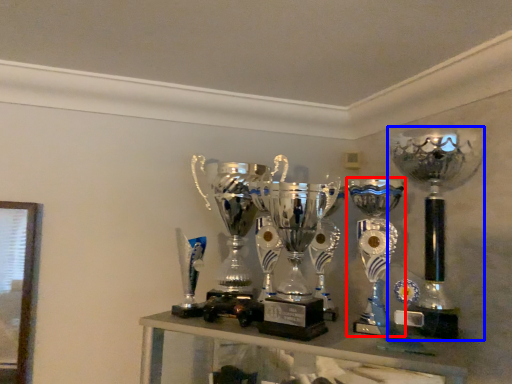
Question: Which point is closer to the camera, trophy (highlighted by a red box) or trophy (highlighted by a blue box)?

Choices:
 (A) trophy
 (B) trophy

Answer: (A)